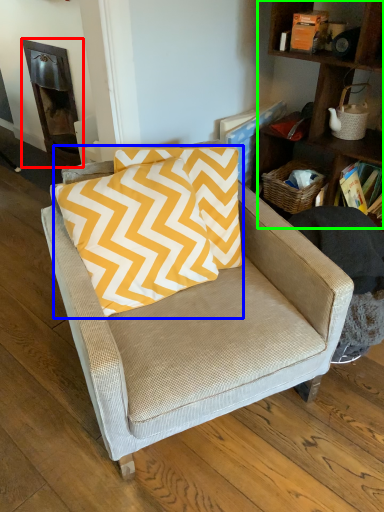
Question: Considering the real-world distances, which object is farthest from fireplace (highlighted by a red box)? pillow (highlighted by a blue box) or shelf (highlighted by a green box)?

Choices:
 (A) pillow
 (B) shelf

Answer: (B)